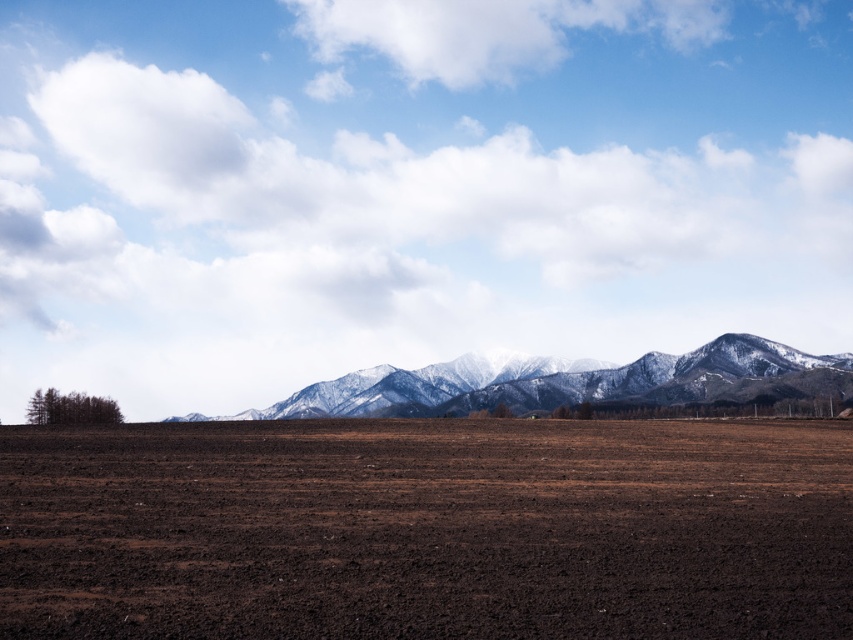
Question: In this image, where is white fluffy cloud at upper center located relative to snow-covered mountains at center?

Choices:
 (A) above
 (B) below

Answer: (A)

Question: From the image, what is the correct spatial relationship of brown soil at center in relation to snow-covered mountains at center?

Choices:
 (A) below
 (B) above

Answer: (B)

Question: Is white fluffy cloud at upper center thinner than snow-covered mountains at center?

Choices:
 (A) no
 (B) yes

Answer: (A)

Question: Which object is the closest to the snow-covered mountains at center?

Choices:
 (A) white fluffy cloud at upper center
 (B) brown soil at center

Answer: (A)

Question: Which point is farther to the camera?

Choices:
 (A) snow-covered mountains at center
 (B) white fluffy cloud at upper center
 (C) brown soil at center

Answer: (B)

Question: Which of these objects is positioned closest to the white fluffy cloud at upper center?

Choices:
 (A) brown soil at center
 (B) snow-covered mountains at center

Answer: (B)